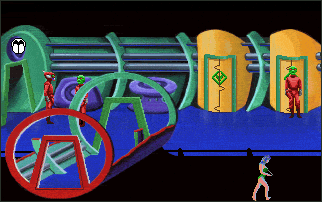
Locate an element on the screen. The width and height of the screenshot is (322, 202). blue floor is located at coordinates (237, 142).